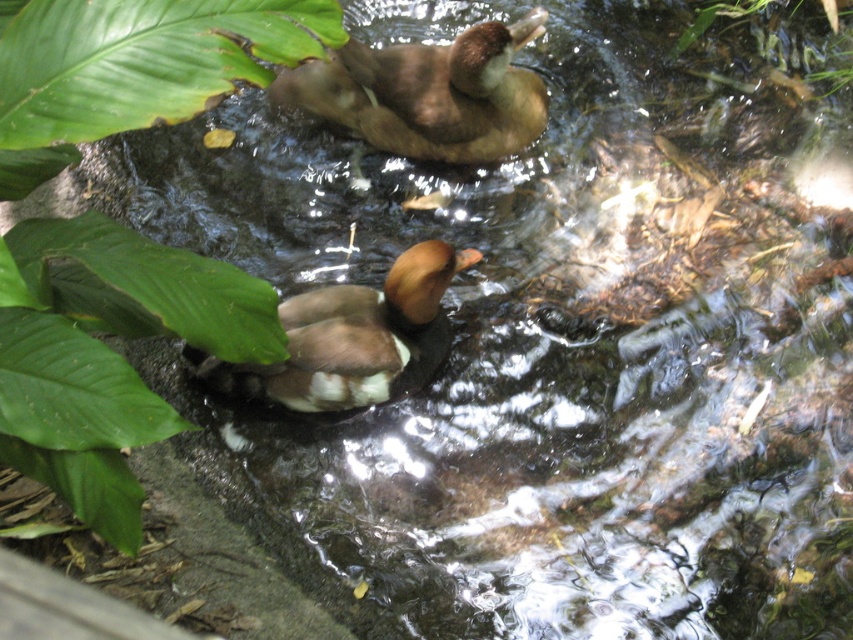
Can you confirm if green leafy plant at lower left is positioned below brown matte duck at center?

Incorrect, green leafy plant at lower left is not positioned below brown matte duck at center.

Who is positioned more to the left, green leafy plant at lower left or brown matte duck at center?

green leafy plant at lower left

This screenshot has width=853, height=640. What do you see at coordinates (106, 353) in the screenshot? I see `green leafy plant at lower left` at bounding box center [106, 353].

This screenshot has width=853, height=640. Identify the location of green leafy plant at lower left. 106,353.

Who is more distant from viewer, (465, 134) or (341, 307)?

Point (465, 134)

Does brown matte duck at upper center have a lesser width compared to brown matte duck at center?

Incorrect, brown matte duck at upper center's width is not less than brown matte duck at center's.

This screenshot has height=640, width=853. I want to click on brown matte duck at upper center, so click(x=428, y=93).

Does brown matte duck at center have a greater width compared to green leafy plant at upper right?

Indeed, brown matte duck at center has a greater width compared to green leafy plant at upper right.

Is brown matte duck at center bigger than green leafy plant at upper right?

Yes, brown matte duck at center is bigger than green leafy plant at upper right.

Describe the element at coordinates (352, 339) in the screenshot. I see `brown matte duck at center` at that location.

At what (x,y) coordinates should I click in order to perform the action: click on brown matte duck at center. Please return your answer as a coordinate pair (x, y). Looking at the image, I should click on (352, 339).